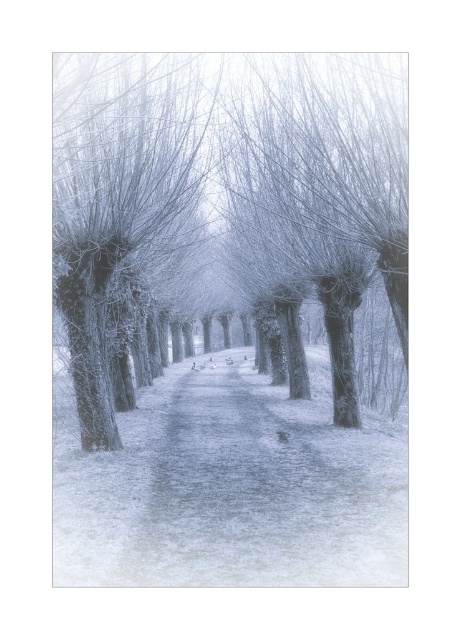
You are standing at the entrance of the snowy gravel path at center and want to reach the smooth bark tree at center. Which direction should you walk to get closer to the tree?

The snowy gravel path at center is located below smooth bark tree at center, so you should walk upwards along the snowy gravel path at center to reach the tree.

You are a hiker carrying a 2.5 meter long ladder. You want to place the ladder horizontally between the smooth bark trees at center and the snowy gravel path at center. Is there enough space to do so without bending the ladder?

The smooth bark trees at center and snowy gravel path at center are 3.88 meters apart from each other. Since the ladder is 2.5 meters long, there is enough space to place it horizontally between them without bending the ladder.

You are planning to place a small bench along the snowy gravel path at center for visitors to rest. Considering the size of the smooth bark trees at center, will the bench be easily visible to someone walking towards the path?

The smooth bark trees at center is larger in size than the snowy gravel path at center, so the bench placed along the snowy gravel path at center might be partially obscured by the larger trees, making it less visible to someone approaching the path.